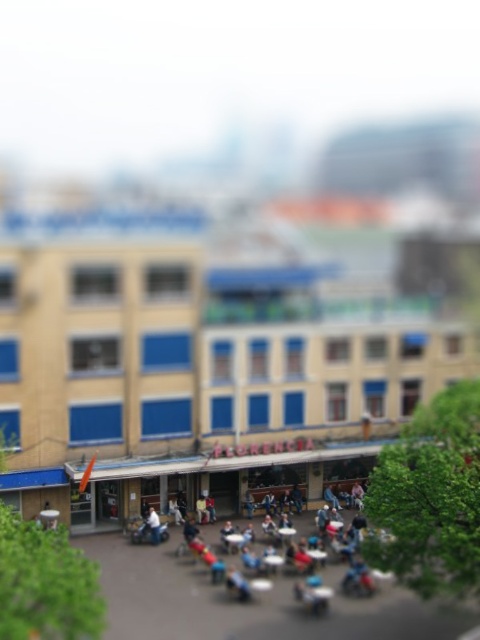
How much distance is there between blue fabric chair at center and white fabric jacket at center?

They are 2.28 meters apart.

How much distance is there between blue fabric chair at center and white fabric jacket at center?

blue fabric chair at center and white fabric jacket at center are 2.28 meters apart from each other.

Who is more distant from viewer, (184,528) or (156,524)?

Point (184,528)

You are a GUI agent. You are given a task and a screenshot of the screen. Output one action in this format:
    pyautogui.click(x=<x>, y=<y>)
    Task: Click on the blue fabric chair at center
    
    Given the screenshot: What is the action you would take?
    pyautogui.click(x=196, y=541)